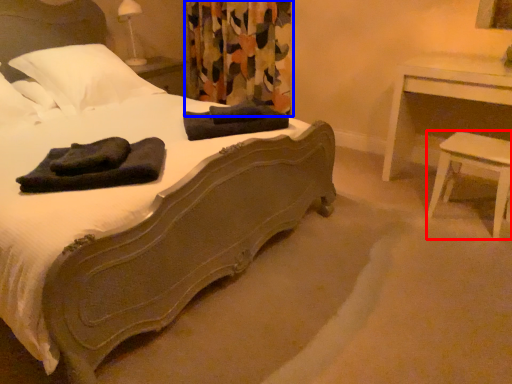
Question: Which object appears farthest to the camera in this image, stool (highlighted by a red box) or curtain (highlighted by a blue box)?

Choices:
 (A) stool
 (B) curtain

Answer: (B)